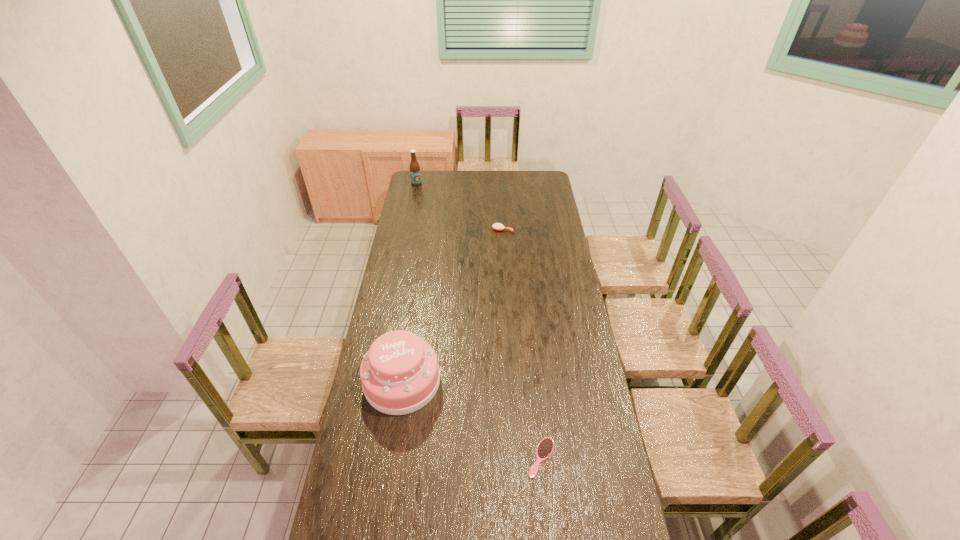
The width and height of the screenshot is (960, 540). I want to click on vacant space located on the back of the nearest object, so (x=537, y=415).

Where is `object that is at the far edge`? This screenshot has width=960, height=540. object that is at the far edge is located at coordinates [415, 175].

At what (x,y) coordinates should I click in order to perform the action: click on beer bottle situated at the left edge. Please return your answer as a coordinate pair (x, y). This screenshot has width=960, height=540. Looking at the image, I should click on (415, 175).

The height and width of the screenshot is (540, 960). I want to click on birthday cake present at the left edge, so click(400, 374).

You are a GUI agent. You are given a task and a screenshot of the screen. Output one action in this format:
    pyautogui.click(x=<x>, y=<y>)
    Task: Click on the object present at the far left corner
    This screenshot has width=960, height=540.
    Given the screenshot: What is the action you would take?
    pyautogui.click(x=415, y=175)

This screenshot has height=540, width=960. Identify the location of free region at the far edge of the desktop. (457, 181).

In order to click on free region at the left edge in this screenshot , I will do `click(394, 291)`.

In the image, there is a desktop. Where is `free space at the right edge`? This screenshot has height=540, width=960. free space at the right edge is located at coordinates (544, 232).

Locate an element on the screen. This screenshot has height=540, width=960. vacant area between the birthday cake and the second shortest object is located at coordinates (452, 306).

Where is `unoccupied position between the shorter hairbrush and the taller hairbrush`? unoccupied position between the shorter hairbrush and the taller hairbrush is located at coordinates (522, 344).